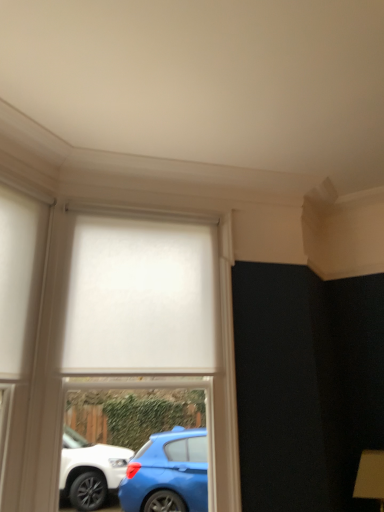
The width and height of the screenshot is (384, 512). Describe the element at coordinates (157, 321) in the screenshot. I see `white matte roller blind at center` at that location.

This screenshot has width=384, height=512. What do you see at coordinates (141, 298) in the screenshot?
I see `white matte curtain at center` at bounding box center [141, 298].

Where is `white matte roller blind at center`? white matte roller blind at center is located at coordinates (157, 321).

Relative to white matte roller blind at center, is white matte glass door at left in front or behind?

Clearly, white matte glass door at left is in front of white matte roller blind at center.

Would you say white matte glass door at left is to the left or to the right of white matte roller blind at center in the picture?

Based on their positions, white matte glass door at left is located to the left of white matte roller blind at center.

Could white matte roller blind at center be considered to be inside white matte glass door at left?

Definitely not — white matte roller blind at center is not inside white matte glass door at left.

From the image's perspective, is white matte glass door at left positioned above or below white matte roller blind at center?

white matte glass door at left is above white matte roller blind at center.

From a real-world perspective, who is located higher, white matte glass door at left or white matte curtain at center?

white matte curtain at center is physically above.

In order to click on curtain that is behind the white matte glass door at left in this screenshot , I will do `click(141, 298)`.

From the picture: Can you confirm if white matte glass door at left is smaller than white matte curtain at center?

Correct, white matte glass door at left occupies less space than white matte curtain at center.

Is white matte roller blind at center wider than white matte glass door at left?

Yes, white matte roller blind at center is wider than white matte glass door at left.

What are the coordinates of `glass door on the left of white matte roller blind at center` in the screenshot? It's located at (19, 321).

Would you say white matte roller blind at center is outside white matte glass door at left?

Yes.

Which is more to the left, white matte roller blind at center or white matte glass door at left?

white matte glass door at left is more to the left.

Is white matte curtain at center further to the viewer compared to white matte roller blind at center?

That is True.

From the image's perspective, relative to white matte roller blind at center, is white matte curtain at center above or below?

Based on their image positions, white matte curtain at center is located above white matte roller blind at center.

From a real-world perspective, is white matte curtain at center physically above white matte roller blind at center?

Yes, from a real-world perspective, white matte curtain at center is over white matte roller blind at center

Can you tell me how much white matte roller blind at center and white matte curtain at center differ in facing direction?

white matte roller blind at center and white matte curtain at center are facing 0.00215 degrees away from each other.

Does white matte roller blind at center have a greater height compared to white matte curtain at center?

Yes.

Are white matte roller blind at center and white matte curtain at center located far from each other?

No, there isn't a large distance between white matte roller blind at center and white matte curtain at center.

Is white matte roller blind at center thinner than white matte curtain at center?

In fact, white matte roller blind at center might be wider than white matte curtain at center.

Does white matte curtain at center appear on the right side of white matte glass door at left?

Indeed, white matte curtain at center is positioned on the right side of white matte glass door at left.

You are a GUI agent. You are given a task and a screenshot of the screen. Output one action in this format:
    pyautogui.click(x=<x>, y=<y>)
    Task: Click on the curtain below the white matte glass door at left (from the image's perspective)
    
    Given the screenshot: What is the action you would take?
    pyautogui.click(x=141, y=298)

In the image, is white matte curtain at center positioned in front of or behind white matte glass door at left?

white matte curtain at center is positioned farther from the viewer than white matte glass door at left.

Is white matte curtain at center shorter than white matte glass door at left?

Correct, white matte curtain at center is not as tall as white matte glass door at left.

Find the location of `bay window behind the white matte glass door at left`. bay window behind the white matte glass door at left is located at coordinates (157, 321).

There is a white matte glass door at left. At what (x,y) coordinates should I click in order to perform the action: click on curtain above it (from a real-world perspective). Please return your answer as a coordinate pair (x, y). Image resolution: width=384 pixels, height=512 pixels. Looking at the image, I should click on (141, 298).

When comparing their distances from white matte curtain at center, does white matte roller blind at center or white matte glass door at left seem closer?

white matte roller blind at center lies closer to white matte curtain at center than the other object.

Which object lies nearer to the anchor point white matte roller blind at center, white matte glass door at left or white matte curtain at center?

white matte curtain at center is closer to white matte roller blind at center.

From the image, which object appears to be nearer to white matte roller blind at center, white matte curtain at center or white matte glass door at left?

white matte curtain at center is closer to white matte roller blind at center.

Looking at the image, which one is located further to white matte glass door at left, white matte curtain at center or white matte roller blind at center?

The object further to white matte glass door at left is white matte roller blind at center.

When comparing their distances from white matte glass door at left, does white matte roller blind at center or white matte curtain at center seem closer?

The object closer to white matte glass door at left is white matte curtain at center.

When comparing their distances from white matte curtain at center, does white matte glass door at left or white matte roller blind at center seem further?

white matte glass door at left.

The width and height of the screenshot is (384, 512). I want to click on curtain situated between white matte glass door at left and white matte roller blind at center from left to right, so click(141, 298).